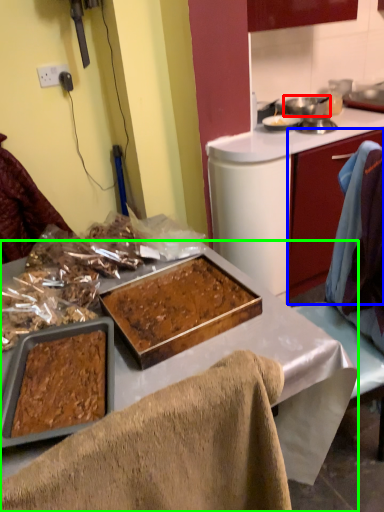
Question: Which is farther away from pot/pan (highlighted by a red box)? cabinetry (highlighted by a blue box) or desk (highlighted by a green box)?

Choices:
 (A) cabinetry
 (B) desk

Answer: (B)